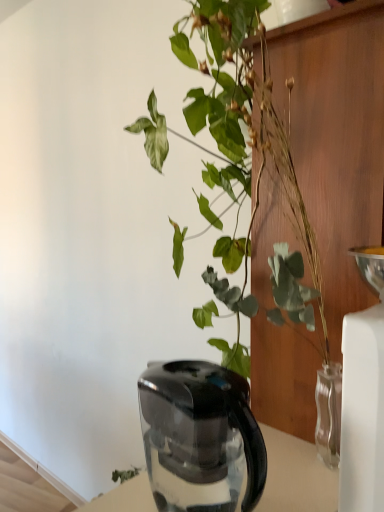
Question: Is the depth of black plastic kettle at lower center greater than that of green glossy plant at upper center?

Choices:
 (A) no
 (B) yes

Answer: (B)

Question: From a real-world perspective, does black plastic kettle at lower center stand above green glossy plant at upper center?

Choices:
 (A) yes
 (B) no

Answer: (B)

Question: Is green glossy plant at upper center at the back of black plastic kettle at lower center?

Choices:
 (A) yes
 (B) no

Answer: (A)

Question: Considering the relative sizes of black plastic kettle at lower center and green glossy plant at upper center in the image provided, is black plastic kettle at lower center taller than green glossy plant at upper center?

Choices:
 (A) yes
 (B) no

Answer: (B)

Question: Considering the relative sizes of black plastic kettle at lower center and green glossy plant at upper center in the image provided, is black plastic kettle at lower center wider than green glossy plant at upper center?

Choices:
 (A) yes
 (B) no

Answer: (B)

Question: Is black plastic kettle at lower center far away from green glossy plant at upper center?

Choices:
 (A) yes
 (B) no

Answer: (B)

Question: Considering the relative sizes of green glossy plant at upper center and black plastic kettle at lower center in the image provided, is green glossy plant at upper center smaller than black plastic kettle at lower center?

Choices:
 (A) yes
 (B) no

Answer: (B)

Question: Is green glossy plant at upper center completely or partially outside of black plastic kettle at lower center?

Choices:
 (A) yes
 (B) no

Answer: (A)

Question: From a real-world perspective, is green glossy plant at upper center positioned under black plastic kettle at lower center based on gravity?

Choices:
 (A) no
 (B) yes

Answer: (A)

Question: Is green glossy plant at upper center bigger than black plastic kettle at lower center?

Choices:
 (A) no
 (B) yes

Answer: (B)

Question: Is green glossy plant at upper center taller than black plastic kettle at lower center?

Choices:
 (A) yes
 (B) no

Answer: (A)

Question: From a real-world perspective, is green glossy plant at upper center on top of black plastic kettle at lower center?

Choices:
 (A) no
 (B) yes

Answer: (B)

Question: Is black plastic kettle at lower center taller or shorter than green glossy plant at upper center?

Choices:
 (A) tall
 (B) short

Answer: (B)